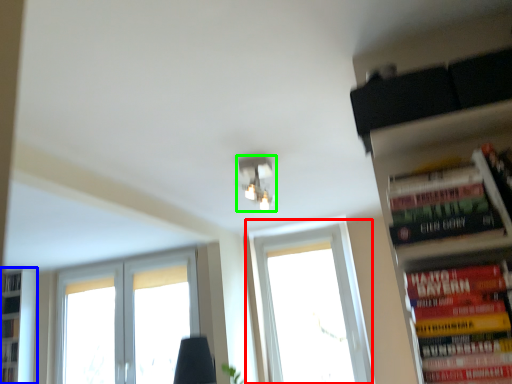
Question: Considering the real-world distances, which object is farthest from window (highlighted by a red box)? bookshelf (highlighted by a blue box) or light fixture (highlighted by a green box)?

Choices:
 (A) bookshelf
 (B) light fixture

Answer: (A)